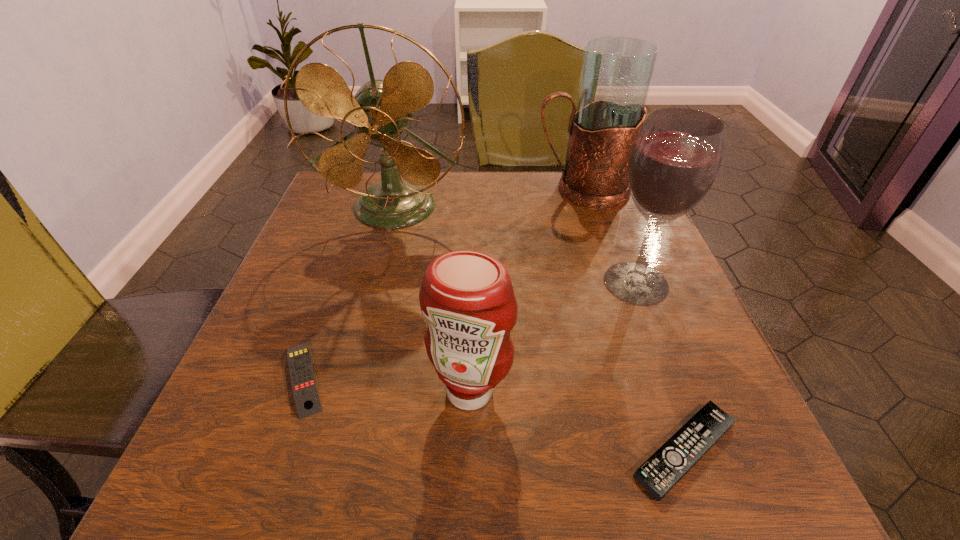
In the image, there is a desktop. Identify the location of vacant space at the right edge. (675, 414).

Image resolution: width=960 pixels, height=540 pixels. In the image, there is a desktop. What are the coordinates of `free space at the far left corner` in the screenshot? It's located at (324, 215).

The height and width of the screenshot is (540, 960). I want to click on vacant space at the near right corner, so click(792, 502).

I want to click on vacant space that is in between the alcohol and the shorter remote control, so click(x=660, y=366).

At what (x,y) coordinates should I click in order to perform the action: click on vacant space that is in between the fourth tallest object and the alcohol. Please return your answer as a coordinate pair (x, y). The height and width of the screenshot is (540, 960). Looking at the image, I should click on (553, 337).

The image size is (960, 540). Find the location of `free spot between the third shortest object and the left remote control`. free spot between the third shortest object and the left remote control is located at coordinates pos(387,384).

In order to click on empty space between the tallest object and the fifth tallest object in this screenshot , I will do `click(349, 293)`.

Locate an element on the screen. unoccupied area between the condiment and the pitcher is located at coordinates [x=526, y=291].

Find the location of a particular element. empty space between the alcohol and the pitcher is located at coordinates (609, 237).

The image size is (960, 540). Find the location of `free space between the fan and the shorter remote control`. free space between the fan and the shorter remote control is located at coordinates (540, 329).